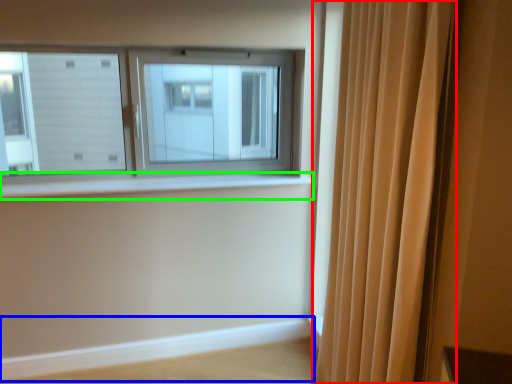
Question: Which is farther away from curtain (highlighted by a red box)? ledge (highlighted by a blue box) or window sill (highlighted by a green box)?

Choices:
 (A) ledge
 (B) window sill

Answer: (A)